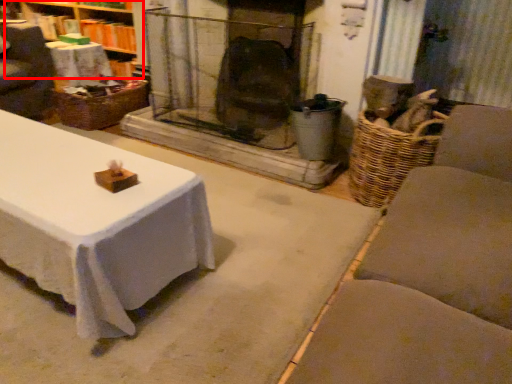
Question: From the image's perspective, where is bookshelf (annotated by the red box) located in relation to basket in the image?

Choices:
 (A) above
 (B) below

Answer: (A)